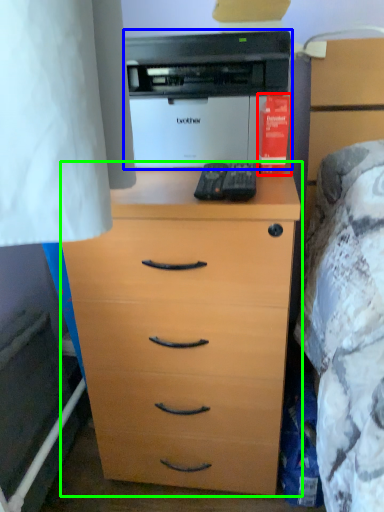
Question: Estimate the real-world distances between objects in this image. Which object is farther from book (highlighted by a red box), printer (highlighted by a blue box) or chest of drawers (highlighted by a green box)?

Choices:
 (A) printer
 (B) chest of drawers

Answer: (B)